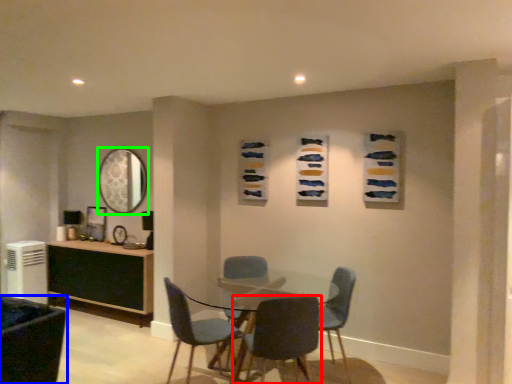
Question: Which is nearer to the chair (highlighted by a red box)? chair (highlighted by a blue box) or mirror (highlighted by a green box).

Choices:
 (A) chair
 (B) mirror

Answer: (A)